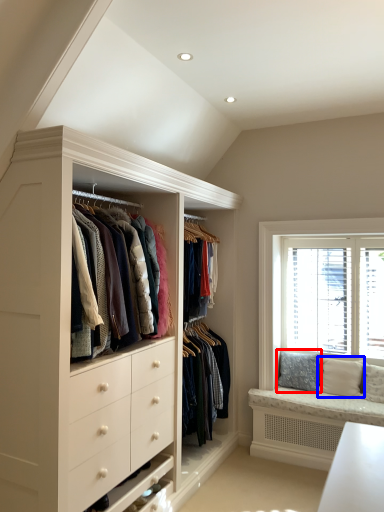
Question: Which object is closer to the camera taking this photo, pillow (highlighted by a red box) or pillow (highlighted by a blue box)?

Choices:
 (A) pillow
 (B) pillow

Answer: (B)